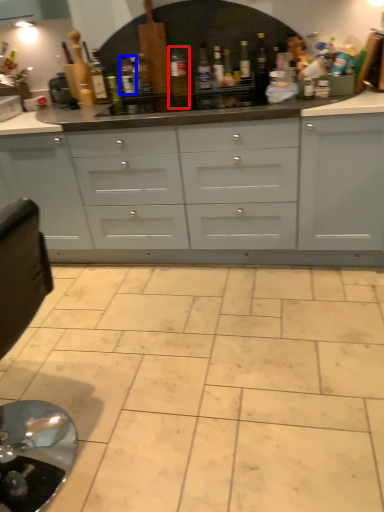
Question: Which object appears closest to the camera in this image, bottle (highlighted by a red box) or bottle (highlighted by a blue box)?

Choices:
 (A) bottle
 (B) bottle

Answer: (A)